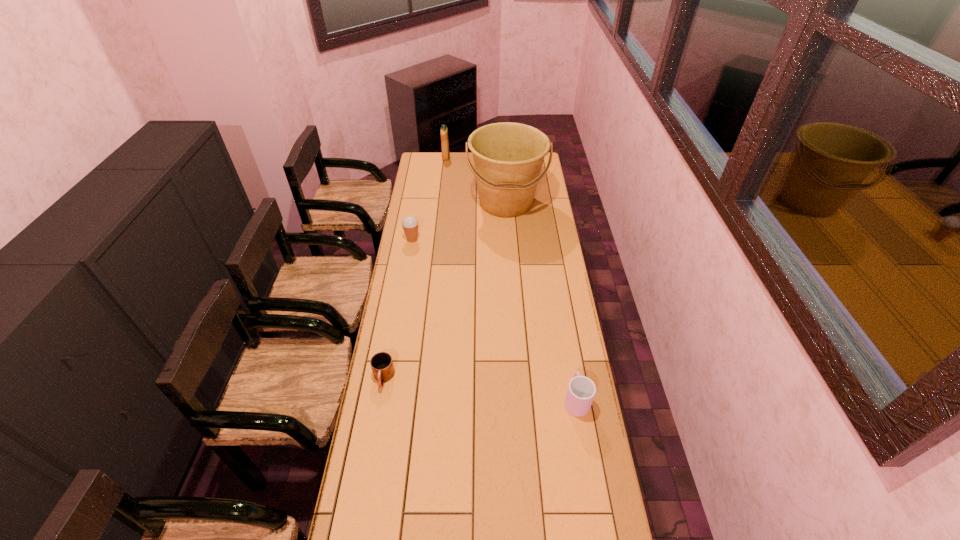
At what (x,y) coordinates should I click in order to perform the action: click on object that is at the far left corner. Please return your answer as a coordinate pair (x, y). The image size is (960, 540). Looking at the image, I should click on pos(444,131).

Image resolution: width=960 pixels, height=540 pixels. Find the location of `vacant space at the left edge of the desktop`. vacant space at the left edge of the desktop is located at coordinates (347, 525).

The height and width of the screenshot is (540, 960). What are the coordinates of `vacant region at the right edge` in the screenshot? It's located at (560, 381).

This screenshot has height=540, width=960. Identify the location of vacant space at the far left corner of the desktop. (433, 170).

Identify the location of free space that is in between the farthest object and the tallest object. (476, 180).

Find the location of `vacant space that is in between the third object from right to left and the second shortest object`. vacant space that is in between the third object from right to left and the second shortest object is located at coordinates (511, 279).

Identify the location of empty space between the fourth nearest object and the second shortest object. This screenshot has width=960, height=540. (541, 301).

Locate an element on the screen. empty space that is in between the detergent and the second farthest object is located at coordinates (476, 180).

Locate an element on the screen. empty space that is in between the icecream and the shortest object is located at coordinates (397, 309).

At what (x,y) coordinates should I click in order to perform the action: click on vacant space that's between the second tallest object and the icecream. Please return your answer as a coordinate pair (x, y). Looking at the image, I should click on (429, 199).